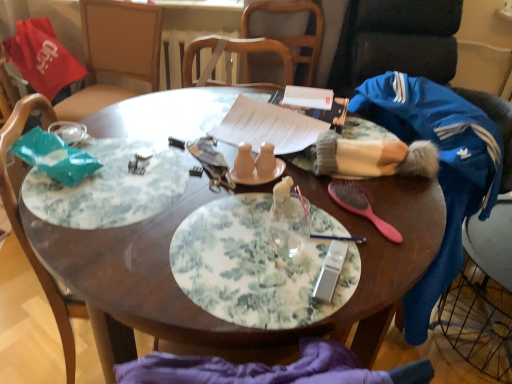
You are a GUI agent. You are given a task and a screenshot of the screen. Output one action in this format:
    pyautogui.click(x=<x>, y=<y>)
    Task: Click on the free space to the right of matte ceramic salt and pepper shakers at center, acting as the 5th tableware starting from the right
    The width and height of the screenshot is (512, 384).
    Given the screenshot: What is the action you would take?
    [316, 199]